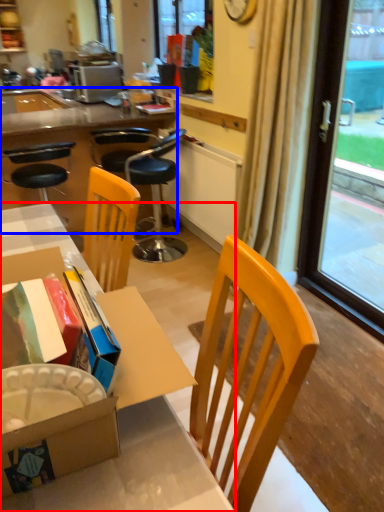
Question: Among these objects, which one is nearest to the camera, desk (highlighted by a red box) or desk (highlighted by a blue box)?

Choices:
 (A) desk
 (B) desk

Answer: (A)